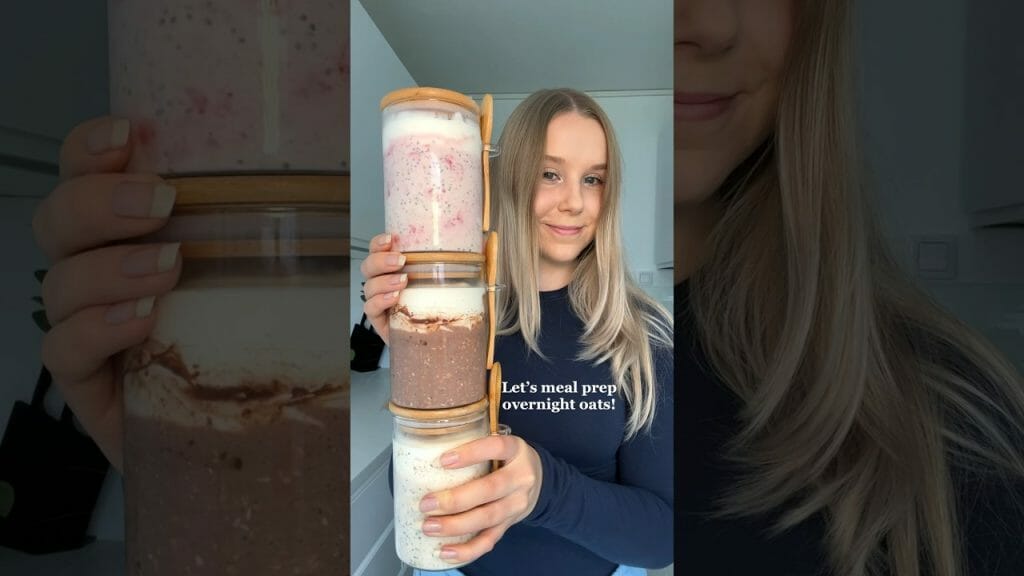
Identify the location of wooden spoons in holder loops. (489, 126), (489, 252), (492, 385).